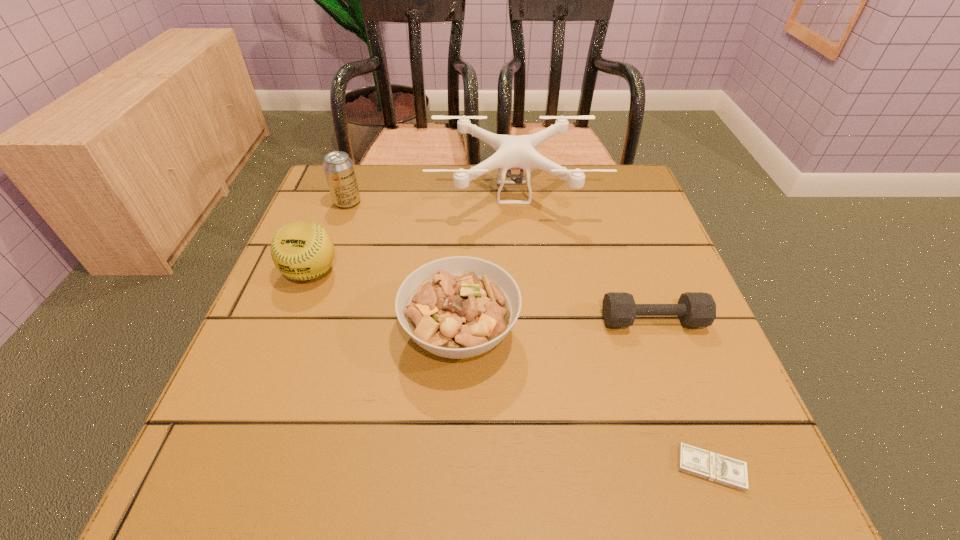
Where is `money present at the right edge`? money present at the right edge is located at coordinates (692, 460).

Locate an element on the screen. The height and width of the screenshot is (540, 960). object at the far left corner is located at coordinates (338, 167).

Where is `object at the far right corner`? object at the far right corner is located at coordinates (512, 152).

Locate an element on the screen. This screenshot has width=960, height=540. object that is at the near right corner is located at coordinates (692, 460).

Image resolution: width=960 pixels, height=540 pixels. I want to click on free space at the far edge, so click(x=422, y=179).

This screenshot has height=540, width=960. In the image, there is a desktop. In order to click on free space at the left edge in this screenshot , I will do `click(287, 305)`.

The image size is (960, 540). In the image, there is a desktop. In order to click on vacant space at the right edge in this screenshot , I will do `click(676, 347)`.

At what (x,y) coordinates should I click in order to perform the action: click on free space at the far right corner of the desktop. Please return your answer as a coordinate pair (x, y). This screenshot has height=540, width=960. Looking at the image, I should click on (594, 197).

Where is `free space between the drone and the money`? free space between the drone and the money is located at coordinates (612, 330).

The width and height of the screenshot is (960, 540). I want to click on free spot between the softball and the nearest object, so click(511, 370).